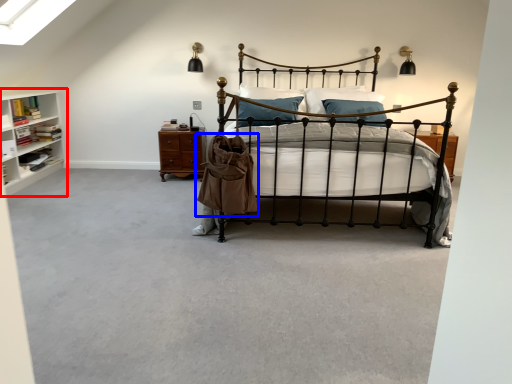
Question: Which point is closer to the camera, shelf (highlighted by a red box) or trench coat (highlighted by a blue box)?

Choices:
 (A) shelf
 (B) trench coat

Answer: (B)